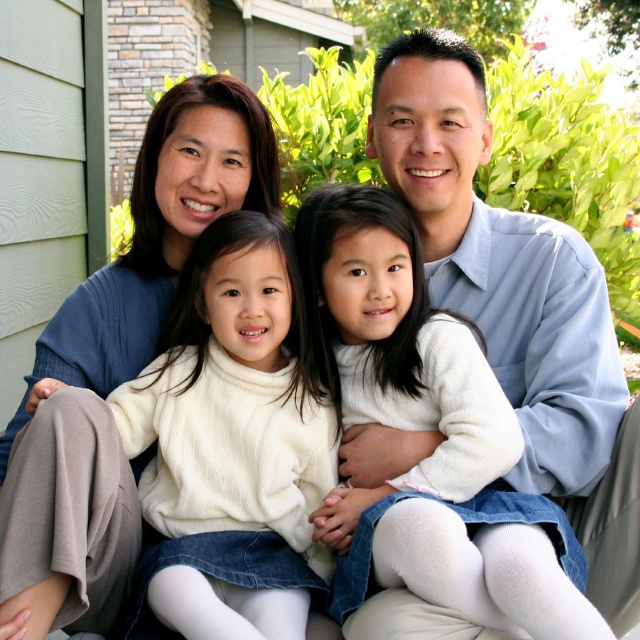
You are an AI analyzing the image. The scene shows a family of four on a porch. You need to determine the exact position of the light blue shirt at upper right. What are its coordinates?

The light blue shirt at upper right is located at coordinates [516,304].

You are a photographer taking a picture of the light blue shirt at upper right and the matte blue sweater at upper left. Which clothing item is positioned higher in the frame?

The light blue shirt at upper right is positioned higher in the frame than the matte blue sweater at upper left because the light blue shirt at upper right is above the matte blue sweater at upper left.

You are a photographer taking a picture of the family. You need to place a small prop between the light blue shirt at upper right and the matte blue sweater at upper left. Where should you place it so it is centered between them?

The light blue shirt at upper right is to the right of matte blue sweater at upper left, so place the prop between them in the middle horizontally.